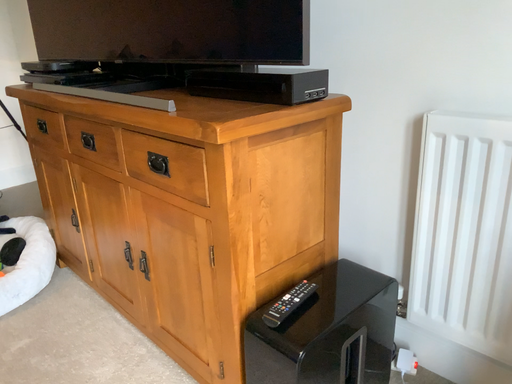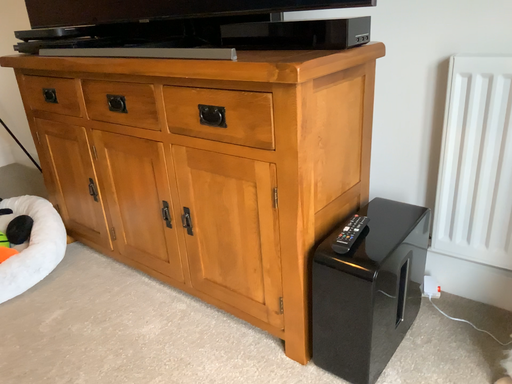
Question: How did the camera likely rotate when shooting the video?

Choices:
 (A) rotated left
 (B) rotated right

Answer: (B)